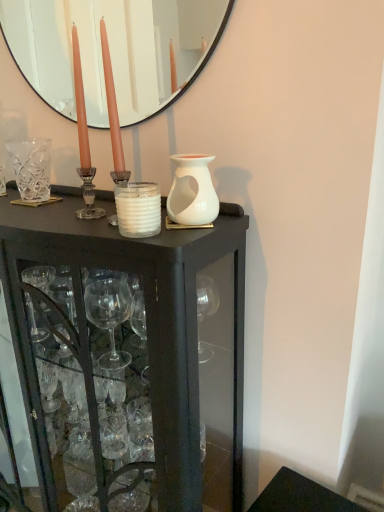
What do you see at coordinates (113, 50) in the screenshot?
I see `matte black mirror at upper center` at bounding box center [113, 50].

What is the approximate height of white matte candle at center?

10.28 centimeters.

This screenshot has height=512, width=384. What do you see at coordinates (138, 209) in the screenshot?
I see `white matte candle at center` at bounding box center [138, 209].

You are a GUI agent. You are given a task and a screenshot of the screen. Output one action in this format:
    pyautogui.click(x=<x>, y=<y>)
    Task: Click on the clear crystal vase at left
    Image resolution: width=384 pixels, height=512 pixels.
    Given the screenshot: What is the action you would take?
    pyautogui.click(x=31, y=168)

Where is `black glass cabinet at center`? black glass cabinet at center is located at coordinates (127, 359).

Find the location of a particular element. Image resolution: width=384 pixels, height=512 pixels. mirror that is above the black glass cabinet at center (from the image's perspective) is located at coordinates (113, 50).

Who is more distant, black glass cabinet at center or matte black mirror at upper center?

matte black mirror at upper center is behind.

From the picture: What's the angular difference between black glass cabinet at center and matte black mirror at upper center's facing directions?

There is a 0.0491-degree angle between the facing directions of black glass cabinet at center and matte black mirror at upper center.

Measure the distance from black glass cabinet at center to matte black mirror at upper center.

They are 3.57 meters apart.

Is white matte candle at center at the back of matte black mirror at upper center?

No.

Considering the sizes of objects matte black mirror at upper center and white matte candle at center in the image provided, who is smaller, matte black mirror at upper center or white matte candle at center?

With smaller size is white matte candle at center.

Consider the image. From the image's perspective, is matte black mirror at upper center located beneath white matte candle at center?

No.

How many degrees apart are the facing directions of matte black mirror at upper center and white matte candle at center?

There is a 1.51-degree angle between the facing directions of matte black mirror at upper center and white matte candle at center.

In the scene shown: From a real-world perspective, between white matte candle at center and white matte vase at center, who is vertically higher?

white matte vase at center, from a real-world perspective.

Does white matte candle at center have a smaller size compared to white matte vase at center?

Yes, white matte candle at center is smaller than white matte vase at center.

Are white matte candle at center and white matte vase at center far apart?

white matte candle at center is near white matte vase at center, not far away.

Is white matte candle at center spatially inside matte black mirror at upper center, or outside of it?

white matte candle at center is outside matte black mirror at upper center.

Is point (143, 222) closer or farther from the camera than point (86, 72)?

Point (143, 222) appears to be closer to the viewer than point (86, 72).

Which of these two, white matte candle at center or matte black mirror at upper center, is wider?

white matte candle at center.

From a real-world perspective, is white matte candle at center under matte black mirror at upper center?

Yes, from a real-world perspective, white matte candle at center is beneath matte black mirror at upper center.

What's the angular difference between black glass cabinet at center and clear crystal vase at left's facing directions?

The angular difference between black glass cabinet at center and clear crystal vase at left is 1.4 degrees.

Considering the relative positions of black glass cabinet at center and clear crystal vase at left in the image provided, is black glass cabinet at center behind clear crystal vase at left?

No.

Could you tell me if black glass cabinet at center is turned towards clear crystal vase at left?

No, black glass cabinet at center is not aimed at clear crystal vase at left.

Does point (176, 302) come farther from viewer compared to point (31, 141)?

No, it is in front of (31, 141).

How many degrees apart are the facing directions of clear crystal vase at left and black glass cabinet at center?

1.4 degrees separate the facing orientations of clear crystal vase at left and black glass cabinet at center.

Is clear crystal vase at left smaller than black glass cabinet at center?

Indeed, clear crystal vase at left has a smaller size compared to black glass cabinet at center.

Is clear crystal vase at left facing away from black glass cabinet at center?

No, clear crystal vase at left is not facing the opposite direction of black glass cabinet at center.

Is clear crystal vase at left far away from black glass cabinet at center?

No, clear crystal vase at left is not far away from black glass cabinet at center.

Is matte black mirror at upper center located outside black glass cabinet at center?

Indeed, matte black mirror at upper center is completely outside black glass cabinet at center.

From a real-world perspective, does matte black mirror at upper center stand above black glass cabinet at center?

Yes.

Is matte black mirror at upper center aimed at black glass cabinet at center?

No, matte black mirror at upper center does not turn towards black glass cabinet at center.

Which is more distant, (x=137, y=103) or (x=176, y=498)?

Positioned behind is point (x=137, y=103).

Locate an element on the screen. table below the matte black mirror at upper center (from a real-world perspective) is located at coordinates (127, 359).

Find the location of a particular element. The width and height of the screenshot is (384, 512). mirror located above the white matte candle at center (from a real-world perspective) is located at coordinates (113, 50).

Looking at the image, which one is located closer to matte black mirror at upper center, white matte candle at center or white matte vase at center?

Based on the image, white matte vase at center appears to be nearer to matte black mirror at upper center.

Which object lies nearer to the anchor point white matte vase at center, white matte candle at center or clear crystal vase at left?

white matte candle at center is positioned closer to the anchor white matte vase at center.

Based on their spatial positions, is matte black mirror at upper center or black glass cabinet at center closer to white matte vase at center?

black glass cabinet at center.

Looking at the image, which one is located closer to white matte vase at center, white matte candle at center or black glass cabinet at center?

white matte candle at center lies closer to white matte vase at center than the other object.

From the image, which object appears to be nearer to clear crystal vase at left, white matte vase at center or white matte candle at center?

white matte candle at center.

Based on their spatial positions, is clear crystal vase at left or black glass cabinet at center further from white matte vase at center?

Based on the image, clear crystal vase at left appears to be further to white matte vase at center.

Estimate the real-world distances between objects in this image. Which object is further from white matte candle at center, matte black mirror at upper center or black glass cabinet at center?

Among the two, matte black mirror at upper center is located further to white matte candle at center.

Based on the photo, estimate the real-world distances between objects in this image. Which object is closer to white matte candle at center, white matte vase at center or black glass cabinet at center?

white matte vase at center is positioned closer to the anchor white matte candle at center.

The image size is (384, 512). Identify the location of candle holder between matte black mirror at upper center and black glass cabinet at center in the up-down direction. (138, 209).

Where is `vase between clear crystal vase at left and black glass cabinet at center in the up-down direction`? vase between clear crystal vase at left and black glass cabinet at center in the up-down direction is located at coordinates (192, 191).

You are a GUI agent. You are given a task and a screenshot of the screen. Output one action in this format:
    pyautogui.click(x=<x>, y=<y>)
    Task: Click on the glass vase between matte black mirror at upper center and white matte candle at center in the vertical direction
    This screenshot has width=384, height=512.
    Given the screenshot: What is the action you would take?
    pyautogui.click(x=31, y=168)

Where is `glass vase that lies between matte black mirror at upper center and black glass cabinet at center from top to bottom`? Image resolution: width=384 pixels, height=512 pixels. glass vase that lies between matte black mirror at upper center and black glass cabinet at center from top to bottom is located at coordinates (31, 168).